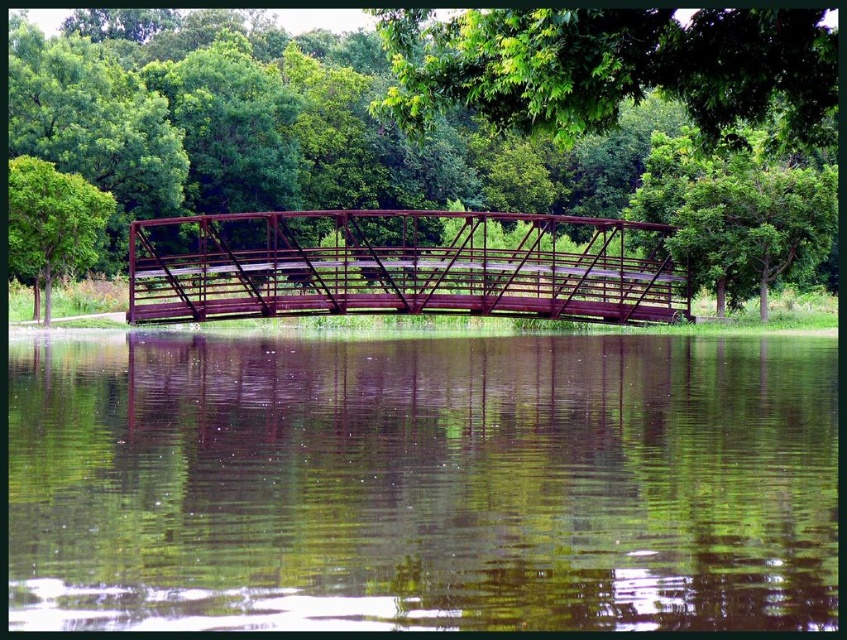
You are standing at the center of the bridge in the image and want to walk towards the point closer to you. Which point should you head towards, point (435, 134) or point (43, 173)?

You should head towards point (43, 173) because it is closer to you than point (435, 134), which is further away.